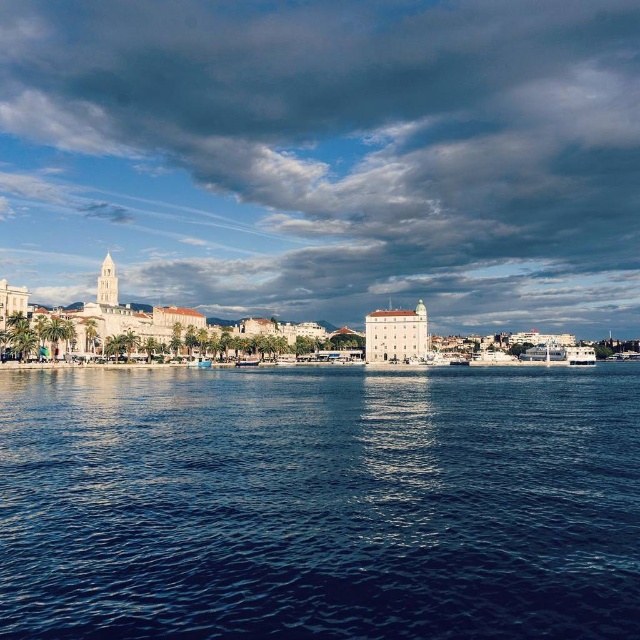
Question: Which of the following is the farthest from the observer?

Choices:
 (A) cloudy sky at upper center
 (B) blue liquid water at center

Answer: (A)

Question: Which object is the farthest from the white glossy boat at lower left?

Choices:
 (A) blue liquid water at center
 (B) cloudy sky at upper center

Answer: (B)

Question: Which of the following is the farthest from the observer?

Choices:
 (A) blue liquid water at center
 (B) white glossy boat at lower left

Answer: (B)

Question: Does cloudy sky at upper center appear on the right side of white glossy boat at lower left?

Choices:
 (A) no
 (B) yes

Answer: (B)

Question: In this image, where is cloudy sky at upper center located relative to white glossy boat at lower left?

Choices:
 (A) above
 (B) below

Answer: (A)

Question: Is cloudy sky at upper center wider than blue liquid water at center?

Choices:
 (A) no
 (B) yes

Answer: (B)